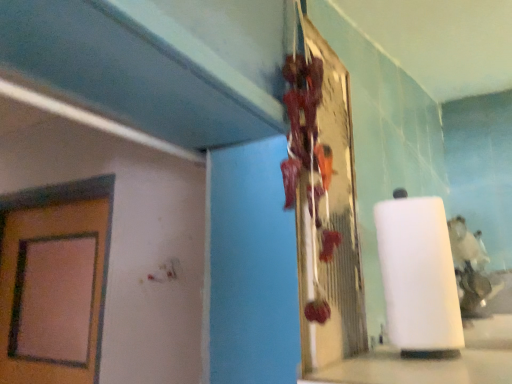
Question: Should I look upward or downward to see white matte paper towel at center?

Choices:
 (A) up
 (B) down

Answer: (B)

Question: Are white matte paper towel at center and metallic reflective board at center located far from each other?

Choices:
 (A) no
 (B) yes

Answer: (A)

Question: Is white matte paper towel at center not inside metallic reflective board at center?

Choices:
 (A) no
 (B) yes

Answer: (B)

Question: From the image's perspective, does white matte paper towel at center appear lower than metallic reflective board at center?

Choices:
 (A) yes
 (B) no

Answer: (A)

Question: Would you say white matte paper towel at center contains metallic reflective board at center?

Choices:
 (A) yes
 (B) no

Answer: (B)

Question: From a real-world perspective, is white matte paper towel at center below metallic reflective board at center?

Choices:
 (A) yes
 (B) no

Answer: (A)

Question: Does white matte paper towel at center have a greater width compared to metallic reflective board at center?

Choices:
 (A) no
 (B) yes

Answer: (B)

Question: Is metallic reflective board at center positioned with its back to white matte paper towel at center?

Choices:
 (A) yes
 (B) no

Answer: (B)

Question: Is metallic reflective board at center further to the viewer compared to white matte paper towel at center?

Choices:
 (A) no
 (B) yes

Answer: (A)

Question: Is metallic reflective board at center completely or partially outside of white matte paper towel at center?

Choices:
 (A) no
 (B) yes

Answer: (B)

Question: Is metallic reflective board at center at the left side of white matte paper towel at center?

Choices:
 (A) yes
 (B) no

Answer: (A)

Question: From a real-world perspective, is metallic reflective board at center physically above white matte paper towel at center?

Choices:
 (A) no
 (B) yes

Answer: (B)

Question: Is metallic reflective board at center oriented towards white matte paper towel at center?

Choices:
 (A) yes
 (B) no

Answer: (B)

Question: From the image's perspective, relative to metallic reflective board at center, is white matte paper towel at center above or below?

Choices:
 (A) above
 (B) below

Answer: (B)